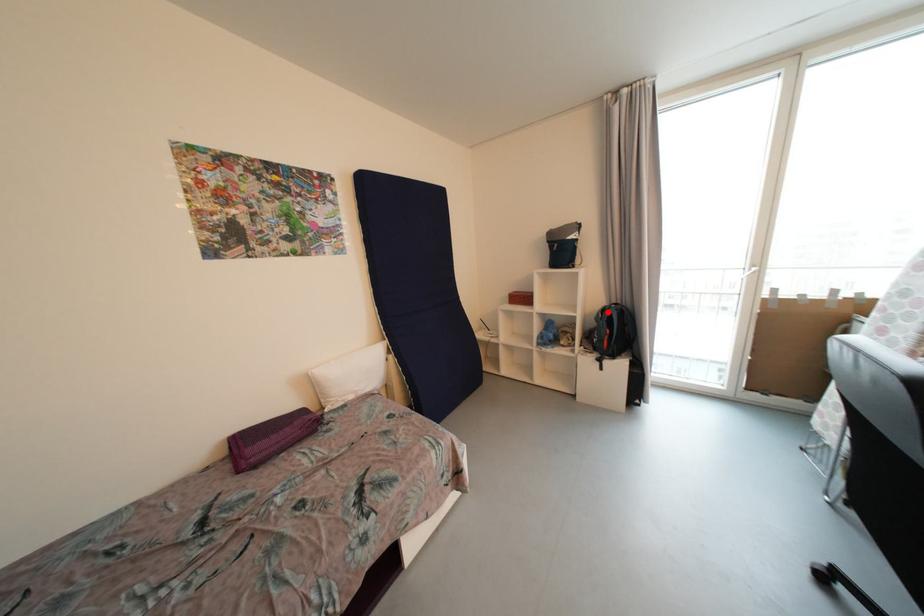
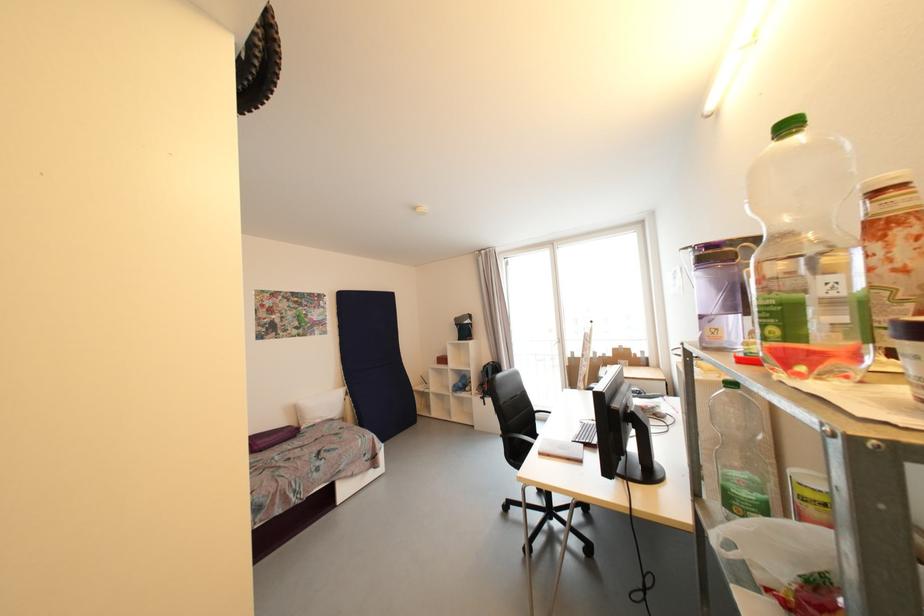
The point at the highlighted location is marked in the first image. Where is the corresponding point in the second image?

(490, 368)